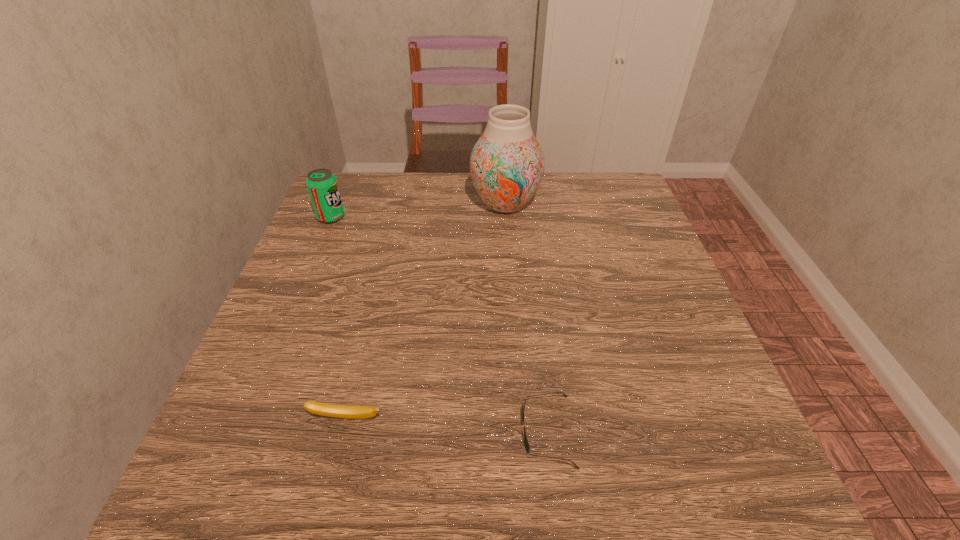
What are the coordinates of `free location at the left edge of the desktop` in the screenshot? It's located at (306, 273).

Locate an element on the screen. free space at the right edge of the desktop is located at coordinates (699, 393).

This screenshot has height=540, width=960. In the image, there is a desktop. What are the coordinates of `free space at the far left corner` in the screenshot? It's located at (354, 210).

Locate an element on the screen. vacant region at the near left corner of the desktop is located at coordinates pyautogui.click(x=217, y=509).

Where is `free region at the near right corner`? This screenshot has width=960, height=540. free region at the near right corner is located at coordinates (683, 453).

Find the location of a particular element. empty space between the third tallest object and the third shortest object is located at coordinates (339, 318).

The image size is (960, 540). I want to click on free space between the pop soda and the tallest object, so click(419, 211).

I want to click on vacant area that lies between the vase and the sunglasses, so click(526, 318).

You are a GUI agent. You are given a task and a screenshot of the screen. Output one action in this format:
    pyautogui.click(x=<x>, y=<y>)
    Task: Click on the vacant space that is in between the vase and the sunglasses
    The height and width of the screenshot is (540, 960).
    Given the screenshot: What is the action you would take?
    526,318

The height and width of the screenshot is (540, 960). Identify the location of vacant space that's between the second shortest object and the vase. (426, 311).